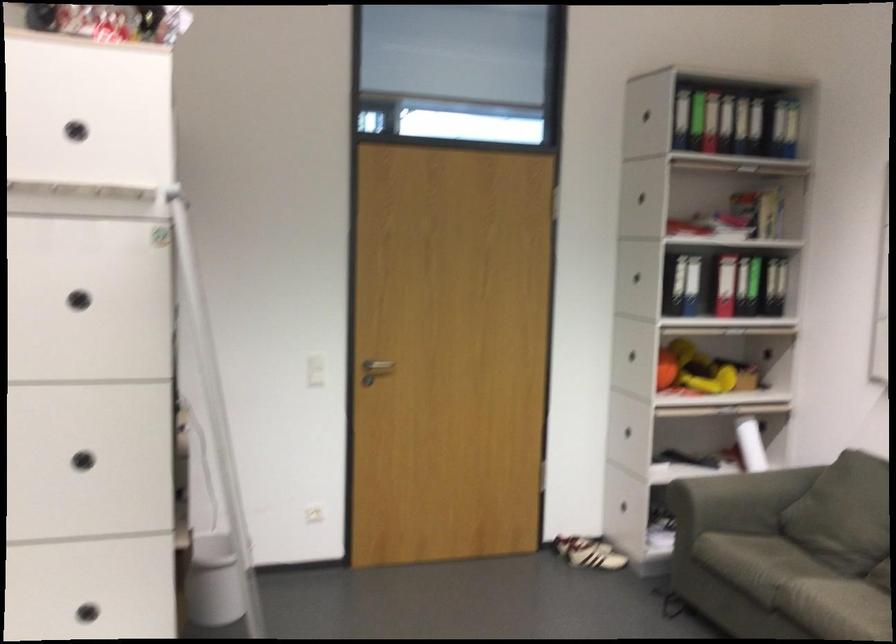
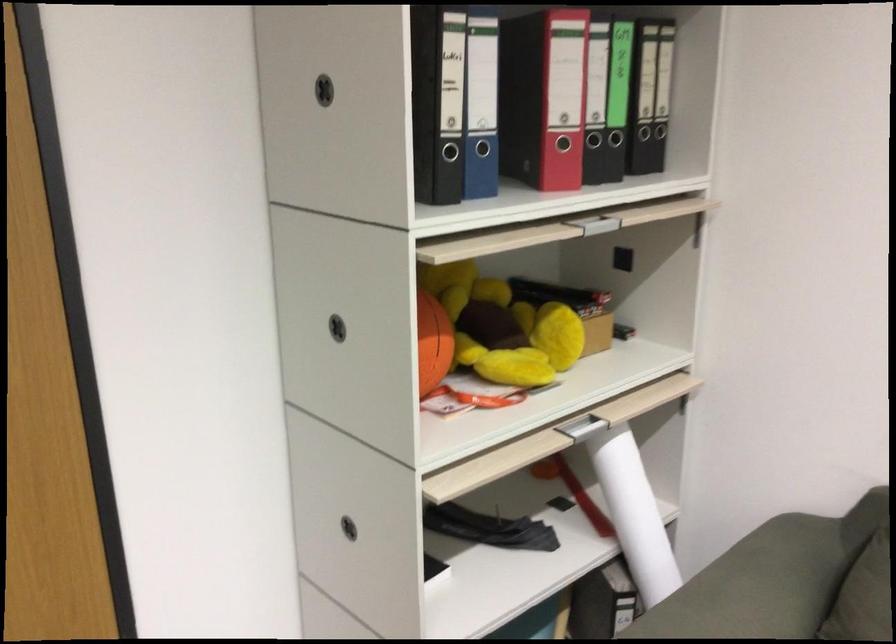
In the second image, find the point that corresponds to (814,345) in the first image.

(743, 260)